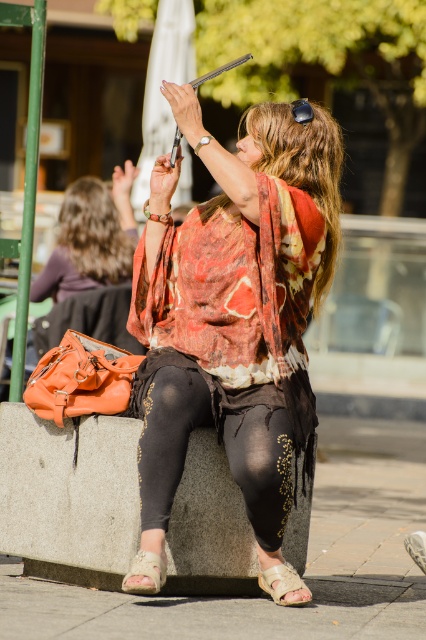
You are a photographer trying to capture the scene of the woman on the stone bench. You notice the matte black phone at upper center and the black matte leggings at center. Which object should you focus on first if you want to capture both in your frame without moving the camera?

The black matte leggings at center should be focused on first since the matte black phone at upper center is to the right of it, allowing you to position the leggings centrally and include the phone in the frame by adjusting the angle slightly without moving the camera.

You are standing in a public space and see a woman sitting on a stone bench. She is holding a tablet or similar device. There is a point marked at coordinates (x=233, y=321). What object is located at that point?

The point at coordinates (x=233, y=321) marks the location of the matte black phone at upper center.